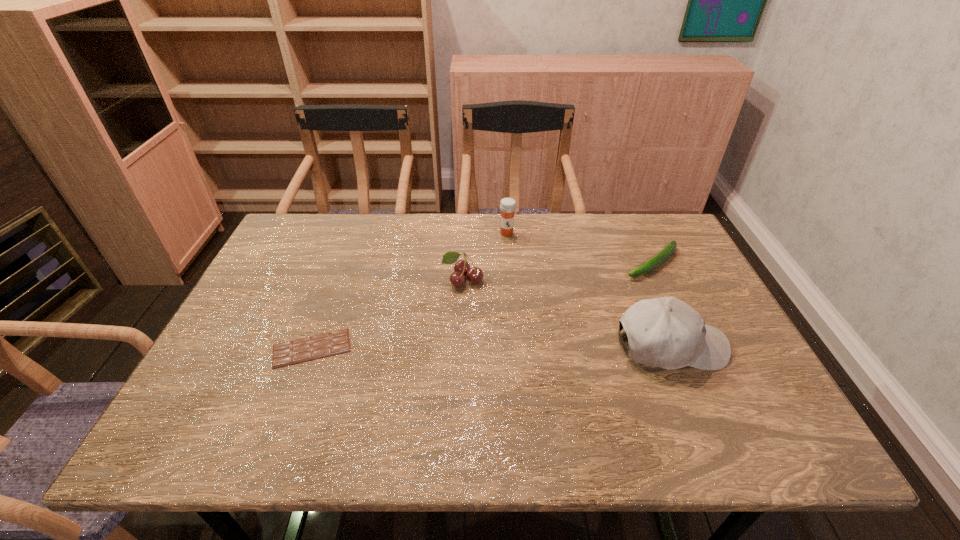
Identify the location of free region at the far left corner of the desktop. (290, 240).

In the image, there is a desktop. Where is `vacant region at the far right corner`? vacant region at the far right corner is located at coordinates (648, 238).

Locate an element on the screen. vacant area that lies between the zucchini and the leftmost object is located at coordinates (482, 306).

Where is `empty space between the chocolate bar and the third tallest object`? Image resolution: width=960 pixels, height=540 pixels. empty space between the chocolate bar and the third tallest object is located at coordinates (387, 314).

This screenshot has height=540, width=960. I want to click on empty location between the farthest object and the baseball cap, so click(588, 289).

Identify the location of empty location between the leftmost object and the fourth tallest object. (482, 306).

Find the location of `vacant area that lies between the second object from left to right and the baseball cap`. vacant area that lies between the second object from left to right and the baseball cap is located at coordinates (566, 313).

Where is `vacant space that's between the zucchini and the chocolate bar`? The height and width of the screenshot is (540, 960). vacant space that's between the zucchini and the chocolate bar is located at coordinates (482, 306).

This screenshot has height=540, width=960. What are the coordinates of `free space between the chocolate bar and the farthest object` in the screenshot? It's located at (409, 291).

Where is `free spot between the zucchini and the shortest object`? free spot between the zucchini and the shortest object is located at coordinates (482, 306).